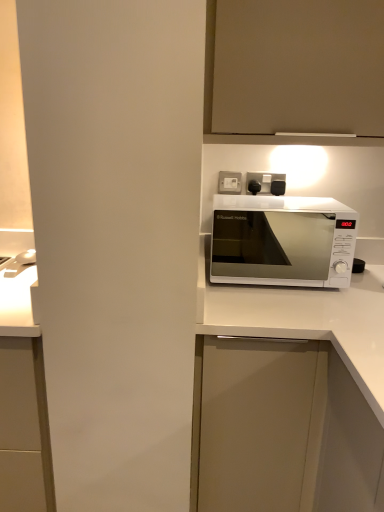
Question: Can you confirm if matte white cabinet at upper center, which is counted as the 2th cabinetry, starting from the bottom, is taller than white matte cabinet at center, which is the 1th cabinetry in bottom-to-top order?

Choices:
 (A) yes
 (B) no

Answer: (B)

Question: From a real-world perspective, is matte white cabinet at upper center, arranged as the first cabinetry when viewed from the top, on white matte cabinet at center, which appears as the 2th cabinetry when viewed from the top?

Choices:
 (A) yes
 (B) no

Answer: (A)

Question: Considering the relative sizes of matte white cabinet at upper center, which is counted as the 2th cabinetry, starting from the bottom, and white matte cabinet at center, which is the 1th cabinetry in bottom-to-top order, in the image provided, is matte white cabinet at upper center, which is counted as the 2th cabinetry, starting from the bottom, bigger than white matte cabinet at center, which is the 1th cabinetry in bottom-to-top order,?

Choices:
 (A) yes
 (B) no

Answer: (B)

Question: Does matte white cabinet at upper center, arranged as the first cabinetry when viewed from the top, have a lesser width compared to white matte cabinet at center, which appears as the 2th cabinetry when viewed from the top?

Choices:
 (A) no
 (B) yes

Answer: (B)

Question: From the image's perspective, would you say matte white cabinet at upper center, arranged as the first cabinetry when viewed from the top, is positioned over white matte cabinet at center, which appears as the 2th cabinetry when viewed from the top?

Choices:
 (A) yes
 (B) no

Answer: (A)

Question: From a real-world perspective, does matte white cabinet at upper center, which is counted as the 2th cabinetry, starting from the bottom, sit lower than white matte cabinet at center, which is the 1th cabinetry in bottom-to-top order?

Choices:
 (A) yes
 (B) no

Answer: (B)

Question: Is white plastic socket at upper center thinner than white glossy microwave at center?

Choices:
 (A) yes
 (B) no

Answer: (A)

Question: Is white plastic socket at upper center located outside white glossy microwave at center?

Choices:
 (A) no
 (B) yes

Answer: (B)

Question: Would you say white plastic socket at upper center is a long distance from white glossy microwave at center?

Choices:
 (A) yes
 (B) no

Answer: (A)

Question: Is white plastic socket at upper center facing away from white glossy microwave at center?

Choices:
 (A) no
 (B) yes

Answer: (A)

Question: Can you confirm if white plastic socket at upper center is positioned to the right of white glossy microwave at center?

Choices:
 (A) yes
 (B) no

Answer: (B)

Question: From a real-world perspective, is white plastic socket at upper center over white glossy microwave at center?

Choices:
 (A) yes
 (B) no

Answer: (A)

Question: Does white matte cabinet at center, which is the 1th cabinetry in bottom-to-top order, appear on the left side of white plastic socket at upper center?

Choices:
 (A) no
 (B) yes

Answer: (A)